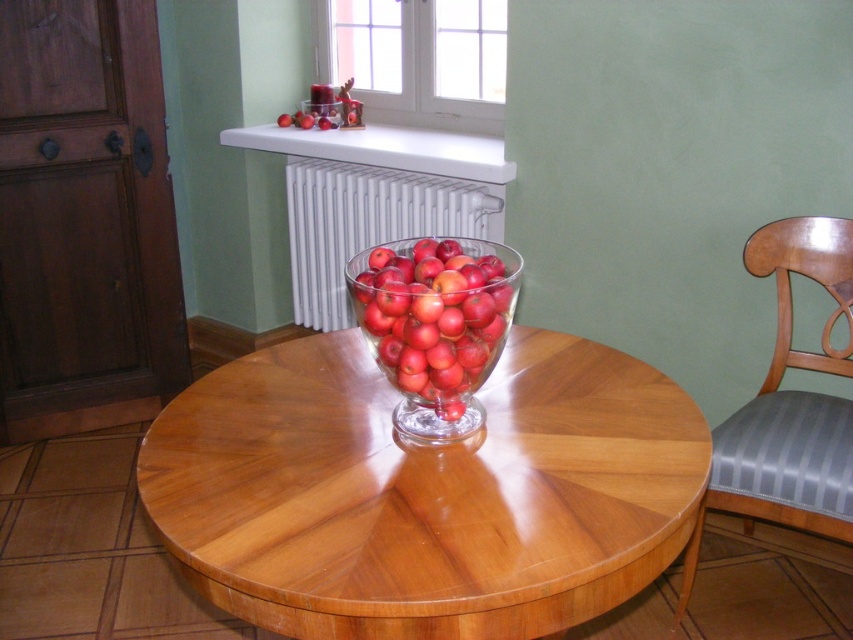
Does wooden chair with striped cushion at right appear on the left side of transparent glass bowl at center?

Incorrect, wooden chair with striped cushion at right is not on the left side of transparent glass bowl at center.

Can you confirm if wooden chair with striped cushion at right is taller than transparent glass bowl at center?

Yes, wooden chair with striped cushion at right is taller than transparent glass bowl at center.

Which is in front, point (822, 499) or point (440, 348)?

Point (440, 348) is more forward.

Locate an element on the screen. This screenshot has width=853, height=640. wooden chair with striped cushion at right is located at coordinates (788, 403).

How distant is wooden table at center from white metallic radiator at upper center?

1.32 meters

Can you confirm if wooden table at center is taller than white metallic radiator at upper center?

No.

Is point (498, 621) positioned before point (323, 301)?

Yes, point (498, 621) is in front of point (323, 301).

Locate an element on the screen. This screenshot has height=640, width=853. wooden table at center is located at coordinates (424, 492).

This screenshot has height=640, width=853. What do you see at coordinates (424, 492) in the screenshot? I see `wooden table at center` at bounding box center [424, 492].

Can you confirm if wooden table at center is positioned to the left of transparent glass bowl at center?

Correct, you'll find wooden table at center to the left of transparent glass bowl at center.

Is point (379, 452) farther from viewer compared to point (416, 304)?

Yes, it is.

Where is `wooden table at center`? The height and width of the screenshot is (640, 853). wooden table at center is located at coordinates (424, 492).